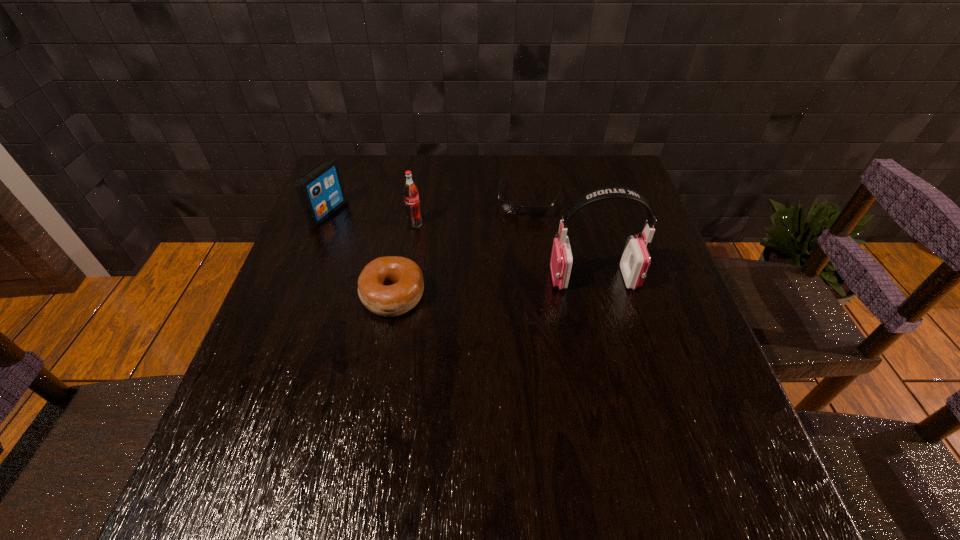
The height and width of the screenshot is (540, 960). In order to click on vacant region located 0.360m on the label of the soda bottle in this screenshot , I will do `click(529, 292)`.

This screenshot has height=540, width=960. What are the coordinates of `vacant area located on the label of the soda bottle` in the screenshot? It's located at (499, 274).

You are a GUI agent. You are given a task and a screenshot of the screen. Output one action in this format:
    pyautogui.click(x=<x>, y=<y>)
    Task: Click on the free space located on the label of the soda bottle
    
    Given the screenshot: What is the action you would take?
    pyautogui.click(x=522, y=288)

Locate an element on the screen. This screenshot has height=540, width=960. free space located 0.160m on the front screen of the leftmost object is located at coordinates (387, 238).

What are the coordinates of `free region located on the front screen of the leftmost object` in the screenshot? It's located at (465, 267).

At what (x,y) coordinates should I click in order to perform the action: click on free space located 0.190m on the front screen of the leftmost object. Please return your answer as a coordinate pair (x, y). The height and width of the screenshot is (540, 960). Looking at the image, I should click on (396, 242).

Identify the location of vacant area situated on the front-facing side of the shortest object. This screenshot has width=960, height=540. (494, 323).

Where is `vacant space located 0.210m on the front-facing side of the shortest object`? vacant space located 0.210m on the front-facing side of the shortest object is located at coordinates (509, 273).

The height and width of the screenshot is (540, 960). In order to click on vacant space situated 0.090m on the front-facing side of the shortest object in this screenshot , I will do `click(517, 240)`.

Find the location of `iPod positioned at the far edge`. iPod positioned at the far edge is located at coordinates (320, 191).